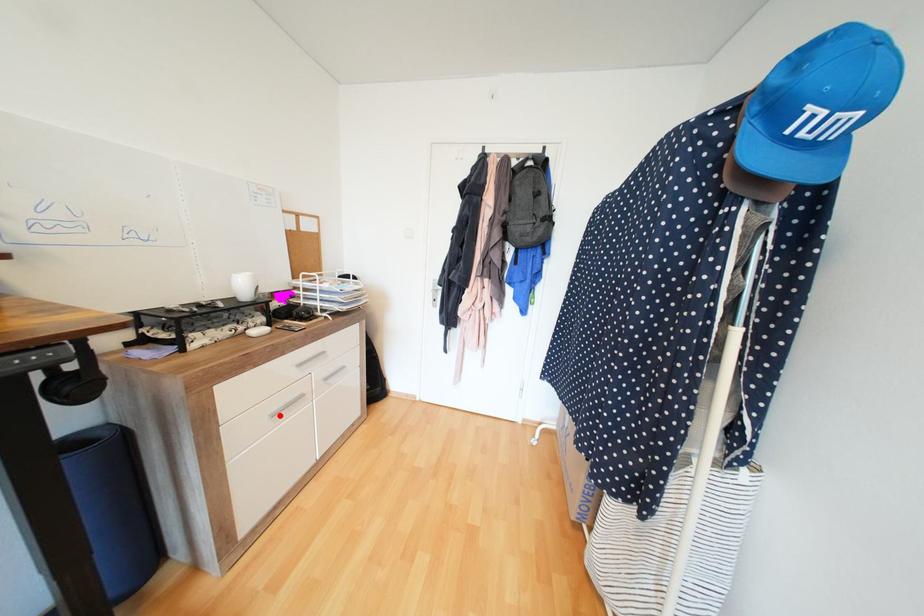
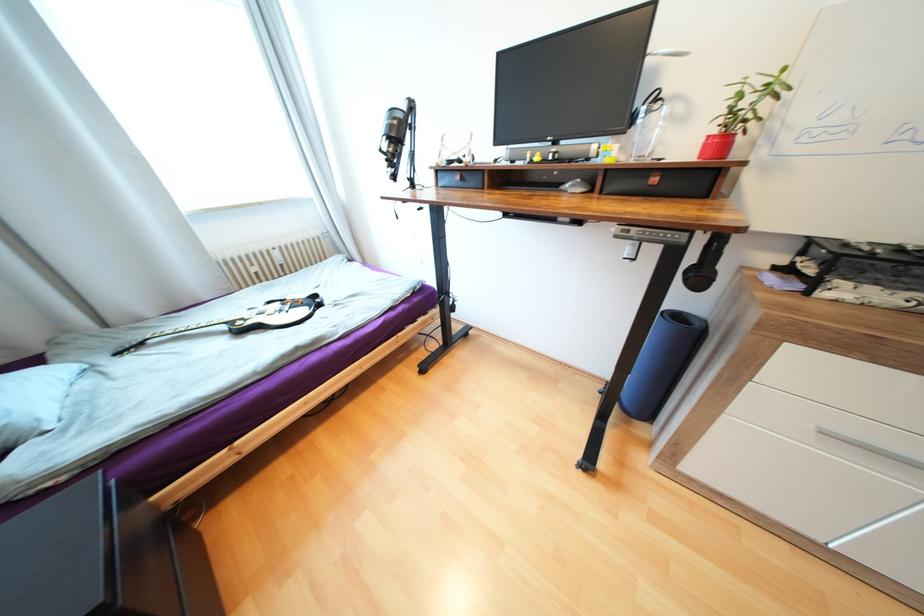
Question: I am providing you with two images of the same scene from different viewpoints. A red point is marked on the first image. Is the red point's position out of view in image 2?

Choices:
 (A) Yes
 (B) No

Answer: (B)